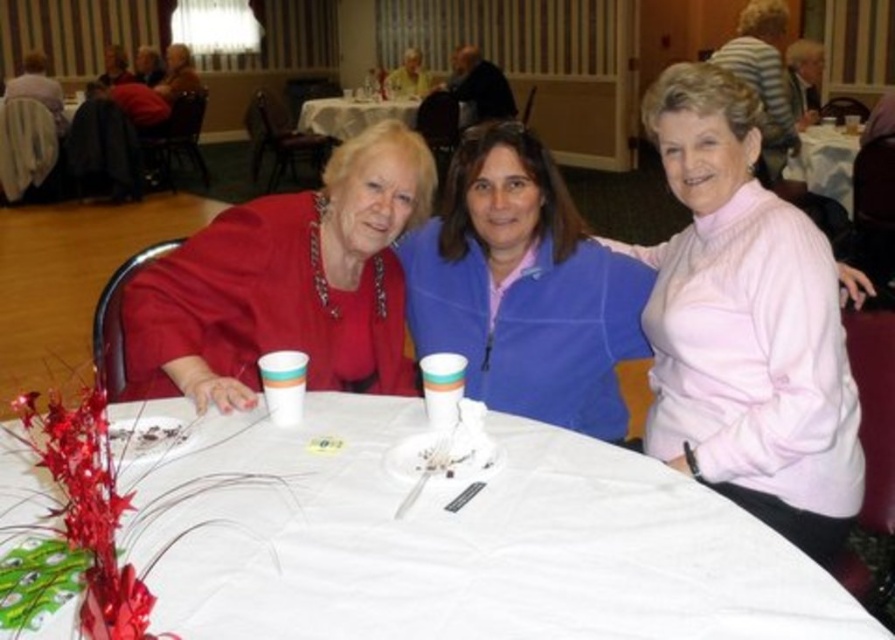
Can you confirm if white fabric tablecloth at center is positioned above white paper plate at upper center?

No.

Who is more distant from viewer, (573,435) or (810,182)?

Point (810,182)

Locate an element on the screen. The width and height of the screenshot is (895, 640). white fabric tablecloth at center is located at coordinates (461, 541).

Based on the photo, between pink turtleneck sweater at upper right and matte yellow shirt at upper center, which one has more height?

Standing taller between the two is pink turtleneck sweater at upper right.

The width and height of the screenshot is (895, 640). Describe the element at coordinates (746, 324) in the screenshot. I see `pink turtleneck sweater at upper right` at that location.

The height and width of the screenshot is (640, 895). I want to click on pink turtleneck sweater at upper right, so click(x=746, y=324).

Measure the distance between white fabric tablecloth at center and camera.

white fabric tablecloth at center is 89.99 centimeters from camera.

Does point (199, 600) lie in front of point (414, 56)?

Yes, point (199, 600) is closer to viewer.

Where is `white fabric tablecloth at center`? white fabric tablecloth at center is located at coordinates (461, 541).